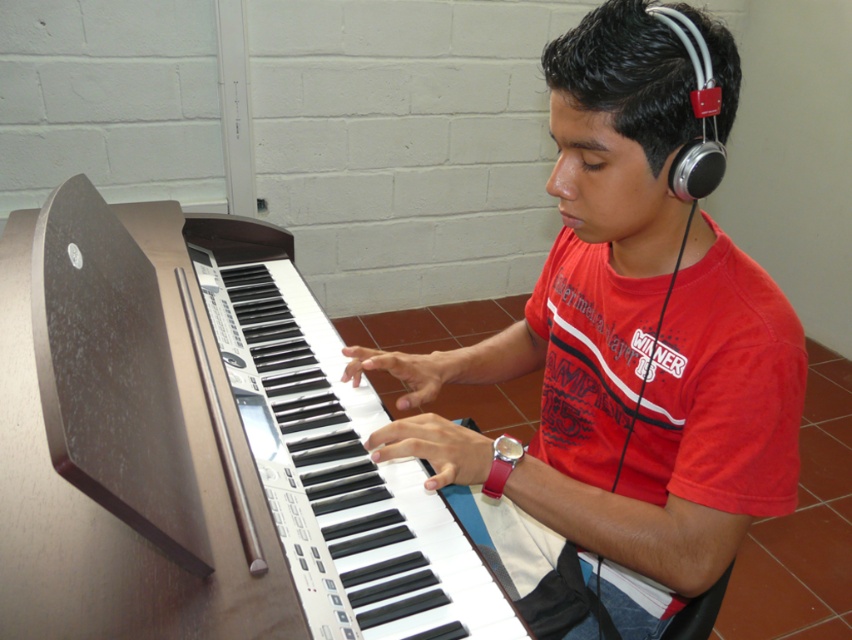
Who is more distant from viewer, (73,289) or (640,285)?

Point (640,285)

Is point (153, 419) positioned in front of point (625, 0)?

No, it is not.

Image resolution: width=852 pixels, height=640 pixels. I want to click on brown polished piano at center, so click(x=202, y=445).